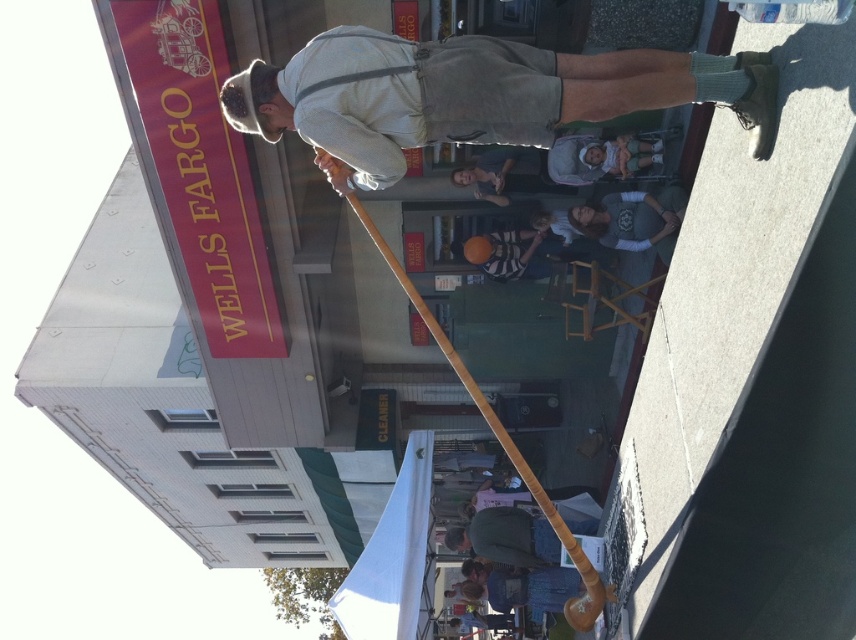
You are standing in front of the Wells Fargo bank building and see a point at coordinates (473,96). What object is located at that point?

The point at coordinates (473,96) is on the light brown wooden cane at center.

You are a photographer setting up a shot at the Wells Fargo bank location. You need to ensure the striped cotton shirt at center is visible above the light brown wooden cane at center. Based on the scene description, is this arrangement possible?

The light brown wooden cane at center is below the striped cotton shirt at center, so yes, the striped cotton shirt at center is visible above the light brown wooden cane at center.